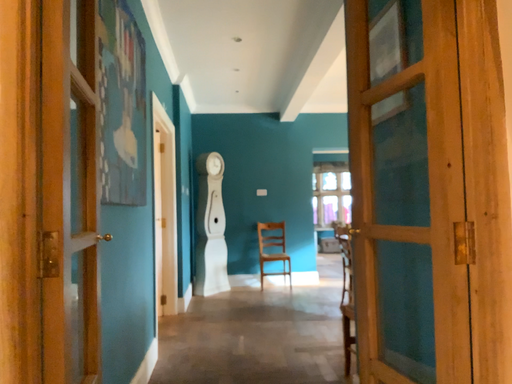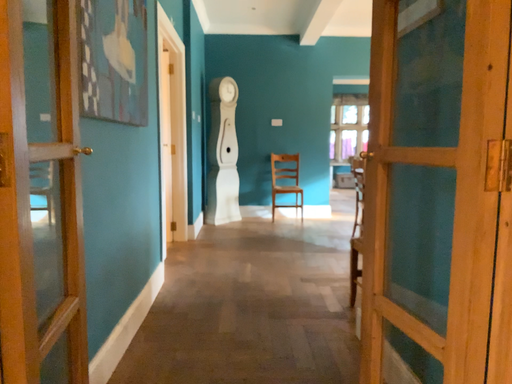
Question: Which way did the camera rotate in the video?

Choices:
 (A) rotated downward
 (B) rotated upward

Answer: (A)